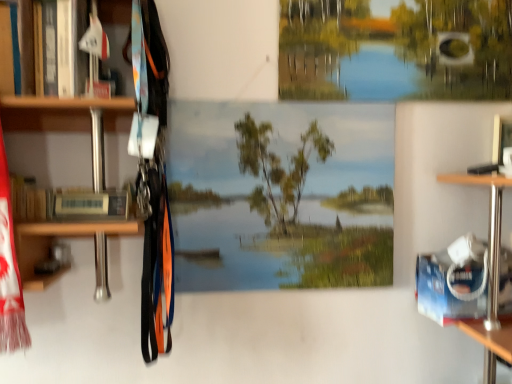
Question: Is green matte tree at upper center located within hardcover book at left?

Choices:
 (A) no
 (B) yes

Answer: (A)

Question: Considering the relative sizes of hardcover book at left and green matte tree at upper center in the image provided, is hardcover book at left taller than green matte tree at upper center?

Choices:
 (A) no
 (B) yes

Answer: (A)

Question: Can you confirm if hardcover book at left is smaller than green matte tree at upper center?

Choices:
 (A) no
 (B) yes

Answer: (B)

Question: From the image's perspective, is hardcover book at left on top of green matte tree at upper center?

Choices:
 (A) yes
 (B) no

Answer: (B)

Question: Can you confirm if hardcover book at left is thinner than green matte tree at upper center?

Choices:
 (A) no
 (B) yes

Answer: (A)

Question: Is hardcover book at left wider than green matte tree at upper center?

Choices:
 (A) no
 (B) yes

Answer: (B)

Question: Considering the relative positions of smooth canvas mural at center and green matte tree at upper center in the image provided, is smooth canvas mural at center behind green matte tree at upper center?

Choices:
 (A) no
 (B) yes

Answer: (A)

Question: From a real-world perspective, is smooth canvas mural at center positioned under green matte tree at upper center based on gravity?

Choices:
 (A) yes
 (B) no

Answer: (A)

Question: Considering the relative positions of smooth canvas mural at center and green matte tree at upper center in the image provided, is smooth canvas mural at center to the left of green matte tree at upper center from the viewer's perspective?

Choices:
 (A) no
 (B) yes

Answer: (B)

Question: Could green matte tree at upper center be considered to be inside smooth canvas mural at center?

Choices:
 (A) yes
 (B) no

Answer: (B)

Question: Can we say smooth canvas mural at center lies outside green matte tree at upper center?

Choices:
 (A) yes
 (B) no

Answer: (A)

Question: Considering the relative sizes of smooth canvas mural at center and green matte tree at upper center in the image provided, is smooth canvas mural at center taller than green matte tree at upper center?

Choices:
 (A) no
 (B) yes

Answer: (B)

Question: Does smooth canvas mural at center have a lesser width compared to hardcover book at left?

Choices:
 (A) no
 (B) yes

Answer: (B)